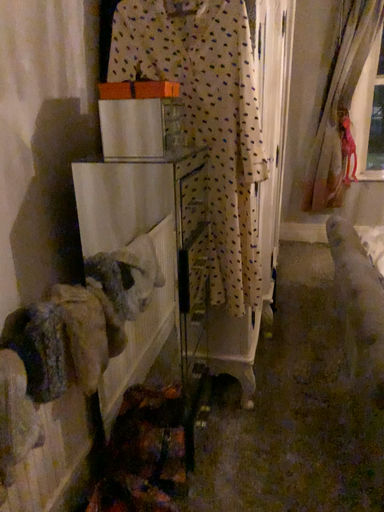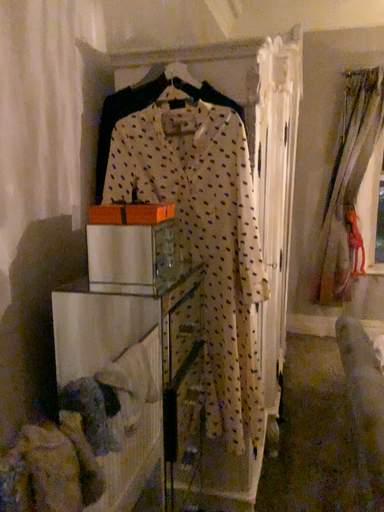
Question: How did the camera likely rotate when shooting the video?

Choices:
 (A) rotated upward
 (B) rotated downward

Answer: (A)